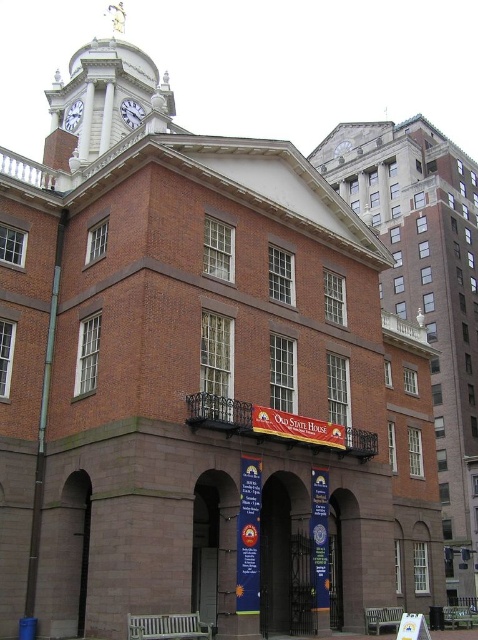
Question: Which of the following is the farthest from the observer?

Choices:
 (A) (100, 134)
 (B) (67, 124)

Answer: (B)

Question: From the image, what is the correct spatial relationship of white marble clock tower at upper left in relation to white glossy clock at upper center?

Choices:
 (A) left
 (B) right

Answer: (B)

Question: Which point appears farthest from the camera in this image?

Choices:
 (A) (335, 148)
 (B) (76, 104)

Answer: (A)

Question: Does white metallic clock at upper center lie in front of silver metallic clock at upper center?

Choices:
 (A) no
 (B) yes

Answer: (B)

Question: Which of the following is the farthest from the observer?

Choices:
 (A) (349, 147)
 (B) (83, 106)
 (C) (105, 116)

Answer: (A)

Question: Is white glossy clock at upper center positioned behind silver metallic clock at upper center?

Choices:
 (A) no
 (B) yes

Answer: (A)